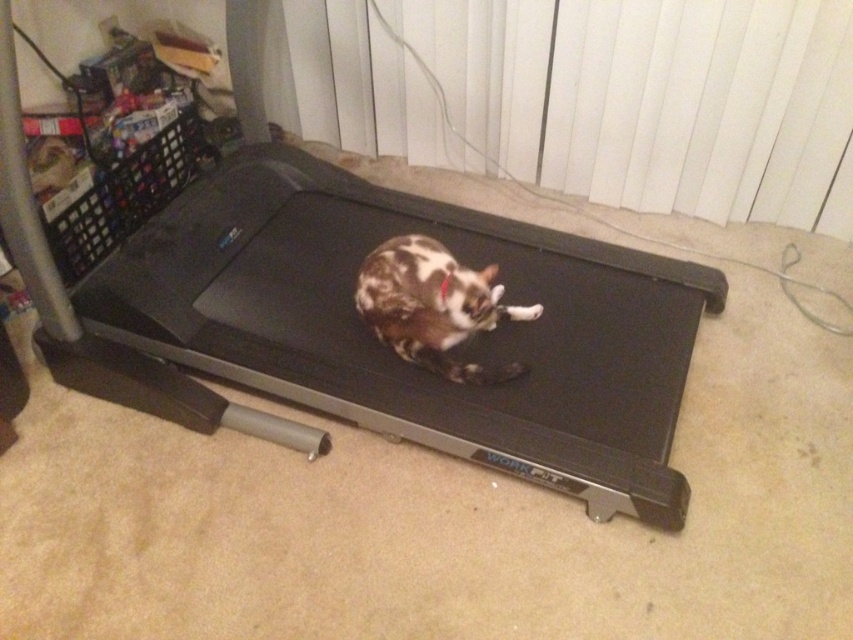
Who is positioned more to the right, black rubber treadmill at center or brown spotted fur cat at center?

From the viewer's perspective, brown spotted fur cat at center appears more on the right side.

Does black rubber treadmill at center have a lesser height compared to brown spotted fur cat at center?

No, black rubber treadmill at center is not shorter than brown spotted fur cat at center.

What do you see at coordinates (398, 358) in the screenshot?
I see `black rubber treadmill at center` at bounding box center [398, 358].

I want to click on black rubber treadmill at center, so click(x=398, y=358).